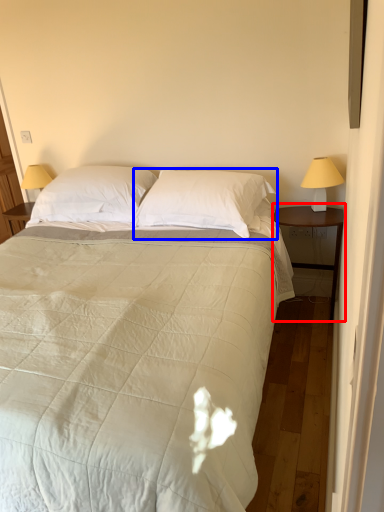
Question: Which point is closer to the camera, nightstand (highlighted by a red box) or pillow (highlighted by a blue box)?

Choices:
 (A) nightstand
 (B) pillow

Answer: (B)